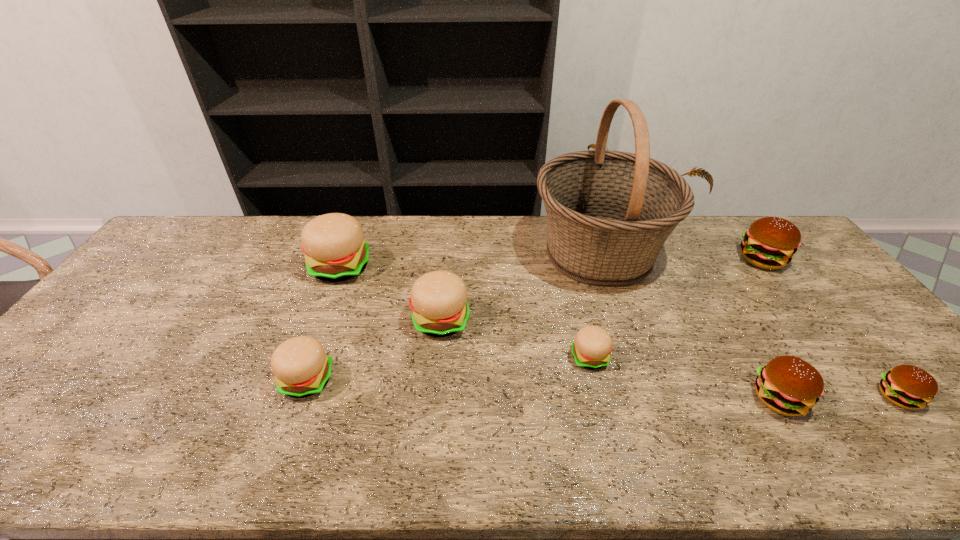
Find the location of a particular element. vacant area that lies between the sixth object from left to right and the tallest object is located at coordinates (688, 326).

At what (x,y) coordinates should I click in order to perform the action: click on unoccupied area between the second biggest brown hamburger and the second smallest beige hamburger. Please return your answer as a coordinate pair (x, y). This screenshot has height=540, width=960. Looking at the image, I should click on (542, 389).

Locate an element on the screen. This screenshot has width=960, height=540. free space between the third biggest beige hamburger and the smallest brown hamburger is located at coordinates (602, 388).

Find the location of a particular element. This screenshot has width=960, height=540. the third closest object to the tallest object is located at coordinates (770, 242).

Choose which object is the second nearest neighbor to the sixth object from right to left. Please provide its 2D coordinates. Your answer should be formatted as a tuple, i.e. [(x, y)], where the tuple contains the x and y coordinates of a point satisfying the conditions above.

[(301, 367)]

You are a GUI agent. You are given a task and a screenshot of the screen. Output one action in this format:
    pyautogui.click(x=<x>, y=<y>)
    Task: Click on the hamburger that is the third closest to the farthest beige hamburger
    
    Given the screenshot: What is the action you would take?
    pyautogui.click(x=591, y=349)

This screenshot has height=540, width=960. I want to click on hamburger that is the closest to the farthest brown hamburger, so click(x=788, y=385).

Image resolution: width=960 pixels, height=540 pixels. Find the location of `beige hamburger that is the closest to the farthest beige hamburger`. beige hamburger that is the closest to the farthest beige hamburger is located at coordinates (438, 299).

Locate an element on the screen. The image size is (960, 540). the closest beige hamburger to the fourth farthest object is located at coordinates (333, 244).

Image resolution: width=960 pixels, height=540 pixels. Find the location of `the closest brown hamburger relative to the third biggest beige hamburger`. the closest brown hamburger relative to the third biggest beige hamburger is located at coordinates (788, 385).